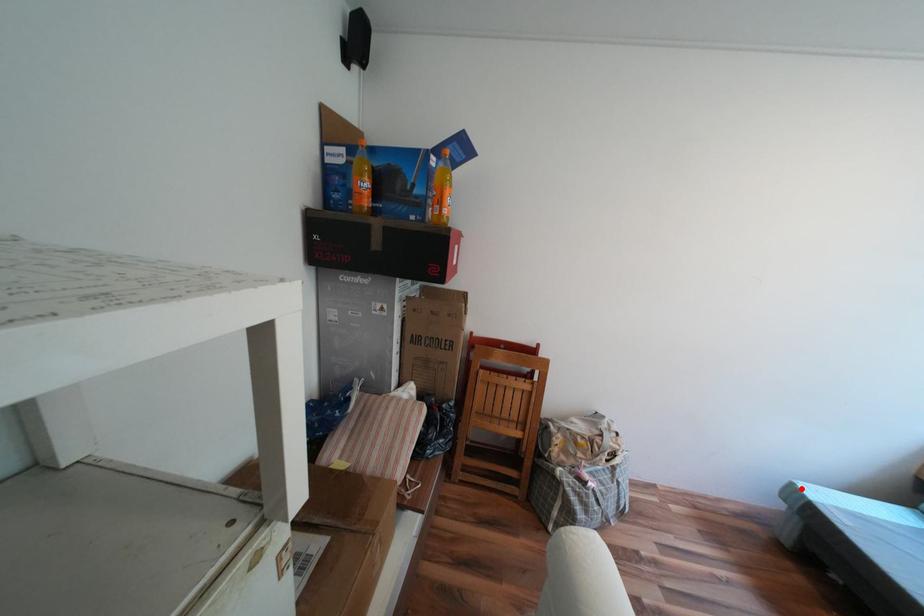
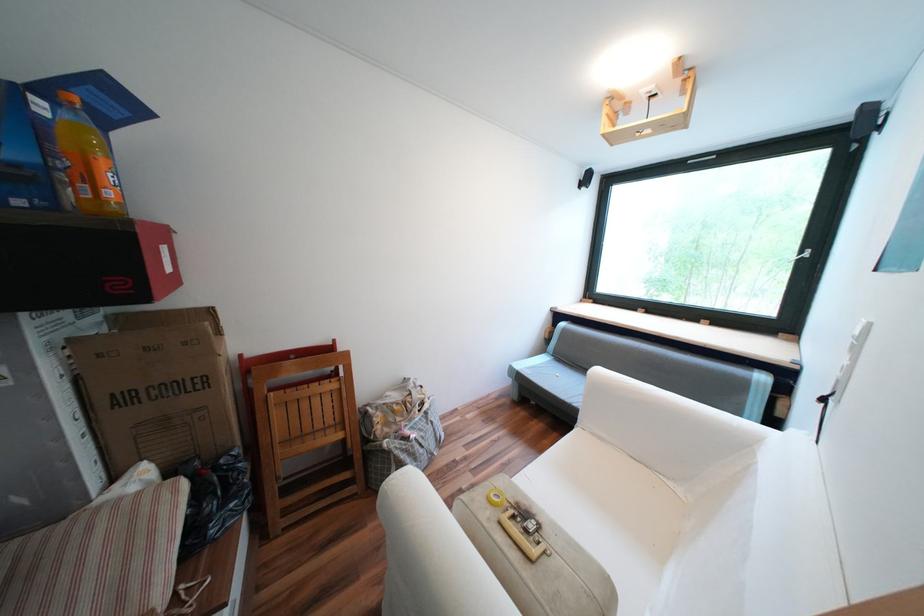
Question: I am providing you with two images of the same scene from different viewpoints. In image1, a red point is highlighted. Considering the same 3D point in image2, which of the following is correct?

Choices:
 (A) It is closer
 (B) It is farther

Answer: (B)